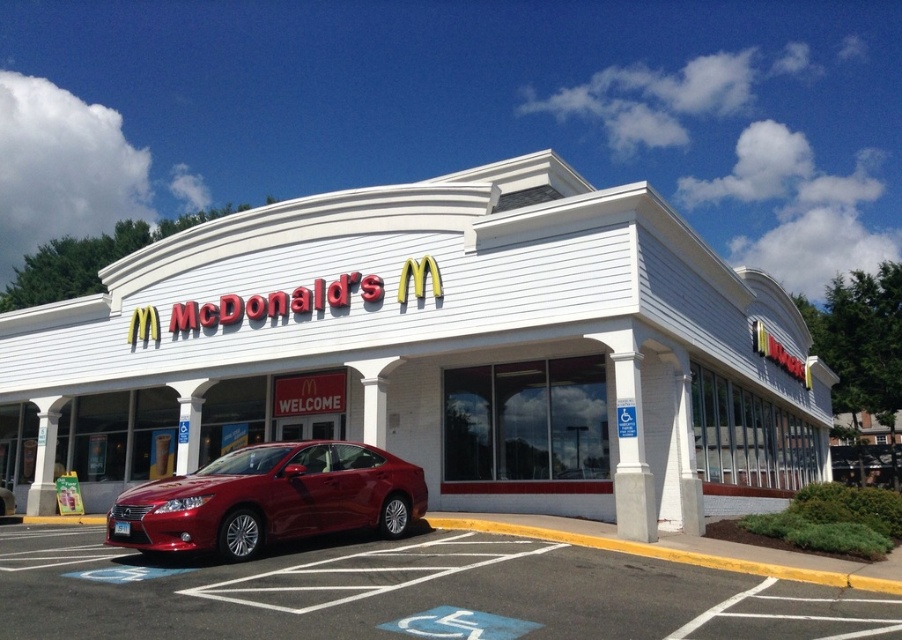
You are a delivery person trying to park your van next to the glossy metallic sedan at center. The smooth asphalt parking lot at lower center is where you want to park. Can you fit your van there if your van is as wide as the sedan?

The smooth asphalt parking lot at lower center is wider than the glossy metallic sedan at center, so yes, the van can fit there since the parking lot is wider than the sedan.